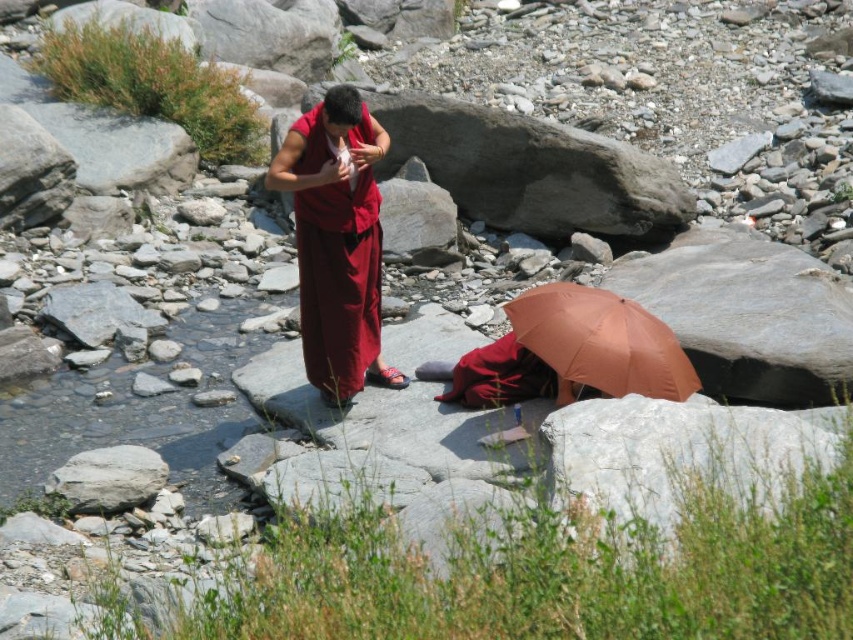
You are a photographer trying to capture the maroon silk robe at center and the orange matte umbrella at lower center in a single frame. Based on their sizes, which object will appear smaller in the photo?

The maroon silk robe at center will appear smaller in the photo because its width is less than the orange matte umbrella at lower center.

You are a photographer trying to capture the maroon silk robe at center and the white smooth rock at lower left in the same frame. Since the robe is covering part of the rock, will you need to adjust your camera angle to see the entire rock?

The maroon silk robe at center is positioned over white smooth rock at lower left, so part of the rock is covered. To see the entire white smooth rock at lower left, you need to adjust your camera angle to capture the area not covered by the robe.

You are a hiker who has just arrived at this rocky area. You see an orange matte umbrella at lower center and a white smooth rock at lower left. Which object is located to the right of the other?

The orange matte umbrella at lower center is positioned on the right side of white smooth rock at lower left.